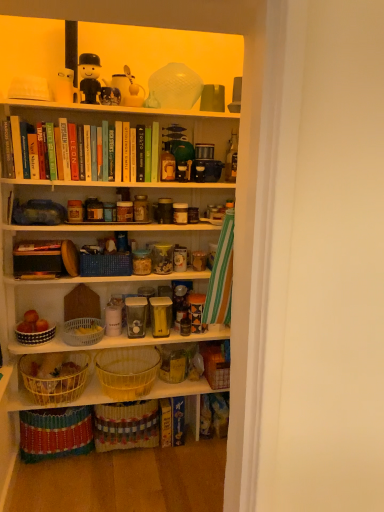
Question: Is matte glass bottle at center, which is the 2th bottle from left to right, shorter than white plastic basket at center, the 2th box viewed from the right?

Choices:
 (A) yes
 (B) no

Answer: (B)

Question: Is matte glass bottle at center, arranged as the 1th bottle when viewed from the right, outside of white plastic basket at center, the 2th box viewed from the right?

Choices:
 (A) yes
 (B) no

Answer: (A)

Question: Is matte glass bottle at center, which is the 2th bottle from left to right, positioned in front of white plastic basket at center, placed as the second box when sorted from left to right?

Choices:
 (A) yes
 (B) no

Answer: (B)

Question: Can you confirm if matte glass bottle at center, which is the 2th bottle from left to right, is positioned to the left of white plastic basket at center, placed as the second box when sorted from left to right?

Choices:
 (A) yes
 (B) no

Answer: (B)

Question: From the image's perspective, is matte glass bottle at center, arranged as the 1th bottle when viewed from the right, on white plastic basket at center, the 2th box viewed from the right?

Choices:
 (A) no
 (B) yes

Answer: (B)

Question: From their relative heights in the image, would you say green matte book at upper center, the fifth book when ordered from right to left, is taller or shorter than matte white coffee cup at upper center?

Choices:
 (A) tall
 (B) short

Answer: (A)

Question: From a real-world perspective, is green matte book at upper center, the fifth book when ordered from right to left, physically located above or below matte white coffee cup at upper center?

Choices:
 (A) above
 (B) below

Answer: (B)

Question: From the image's perspective, is green matte book at upper center, which appears as the third book when viewed from the left, above or below matte white coffee cup at upper center?

Choices:
 (A) below
 (B) above

Answer: (A)

Question: Considering the positions of point (139, 147) and point (208, 111), is point (139, 147) closer or farther from the camera than point (208, 111)?

Choices:
 (A) farther
 (B) closer

Answer: (B)

Question: From the image's perspective, is hardcover book at center, the second book in the bottom-to-top sequence, located above or below bright yellow wicker basket at lower center?

Choices:
 (A) below
 (B) above

Answer: (A)

Question: Based on their sizes in the image, would you say hardcover book at center, the second book in the right-to-left sequence, is bigger or smaller than bright yellow wicker basket at lower center?

Choices:
 (A) big
 (B) small

Answer: (B)

Question: Is hardcover book at center, arranged as the 6th book when viewed from the top, to the left or to the right of bright yellow wicker basket at lower center in the image?

Choices:
 (A) right
 (B) left

Answer: (A)

Question: In terms of height, does hardcover book at center, the second book in the right-to-left sequence, look taller or shorter compared to bright yellow wicker basket at lower center?

Choices:
 (A) tall
 (B) short

Answer: (B)

Question: In terms of width, does hardcover book at center, the second book in the bottom-to-top sequence, look wider or thinner when compared to white matte bookshelf at upper center?

Choices:
 (A) thin
 (B) wide

Answer: (B)

Question: In the image, is hardcover book at center, the second book in the right-to-left sequence, positioned in front of or behind white matte bookshelf at upper center?

Choices:
 (A) front
 (B) behind

Answer: (B)